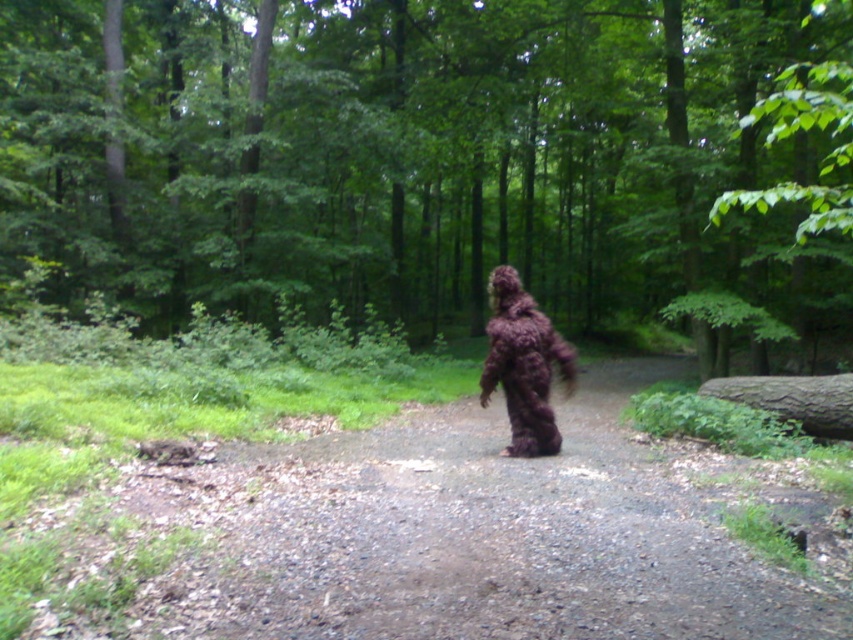
Does point (53, 186) lie in front of point (532, 417)?

No, it is behind (532, 417).

Is the position of brown furry suit at center less distant than that of fuzzy camouflage suit at center?

No, brown furry suit at center is further to the viewer.

What do you see at coordinates (405, 152) in the screenshot?
I see `brown furry suit at center` at bounding box center [405, 152].

The width and height of the screenshot is (853, 640). In order to click on brown furry suit at center in this screenshot , I will do `click(405, 152)`.